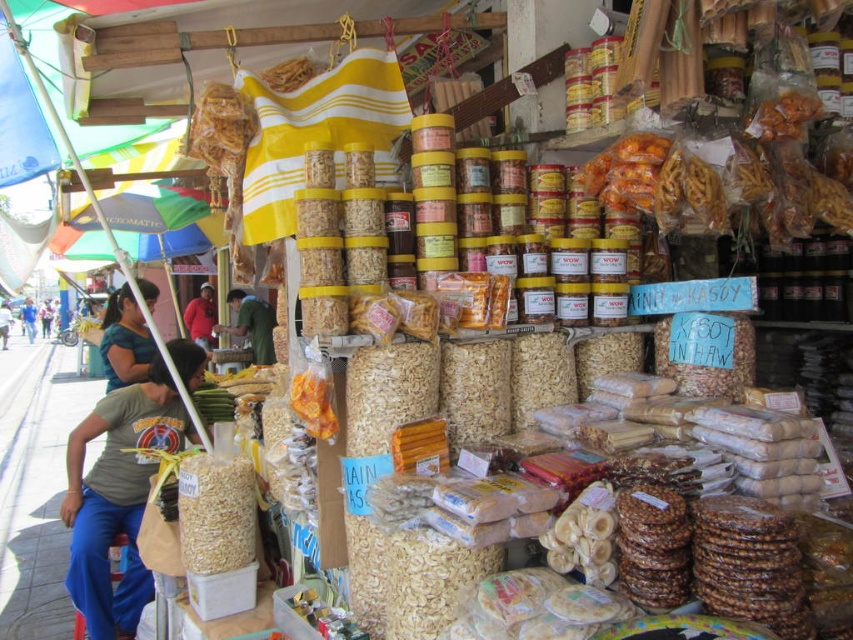
You are a customer at the market stall and want to pick up the brown matte cereal at center and the light green fabric at lower left. Which item will you need to reach for first due to its position?

The brown matte cereal at center is closer to the viewer than the light green fabric at lower left, so you will need to reach for the brown matte cereal at center first.

You are a customer at the market stall and want to grab the light green fabric at lower left and the brown matte cereal at center. Which item should you reach for first if you want to pick up the lower one first?

The brown matte cereal at center is below the light green fabric at lower left, so you should reach for the brown matte cereal at center first if you want to pick up the lower one first.